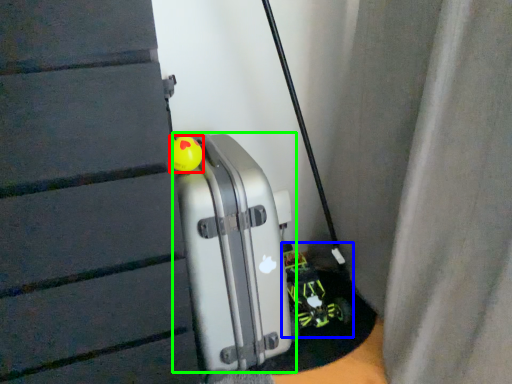
Question: Considering the real-world distances, which object is closest to toy (highlighted by a red box)? toy car (highlighted by a blue box) or luggage (highlighted by a green box).

Choices:
 (A) toy car
 (B) luggage

Answer: (B)